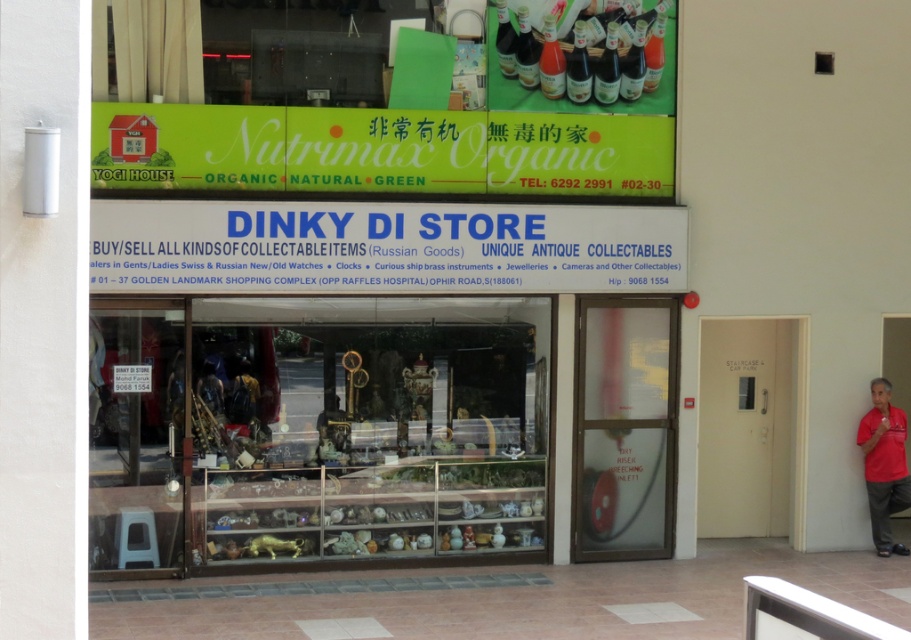
You are a delivery person with a package that is 1.5 meters long. You arrive at the Dinky Di Store and see the white plastic signboard at center and the frosted glass door at center. Can you fit the package horizontally between them?

The white plastic signboard at center and the frosted glass door at center are 1.49 meters apart from each other. Since the package is 1.5 meters long, it cannot fit horizontally between them.

You are standing in front of the Dinky Di Store and want to locate the red shirt at right. Where would you look in the storefront window?

The red shirt at right is located at the 2D coordinates point (884, 465) in the storefront window.

You are a customer standing in front of the Dinky Di Store. You want to enter the store but notice two items in the center of the storefront. Which item is bigger between the white plastic signboard at center and the frosted glass door at center?

The white plastic signboard at center is larger in size than the frosted glass door at center, so the white plastic signboard at center is bigger.